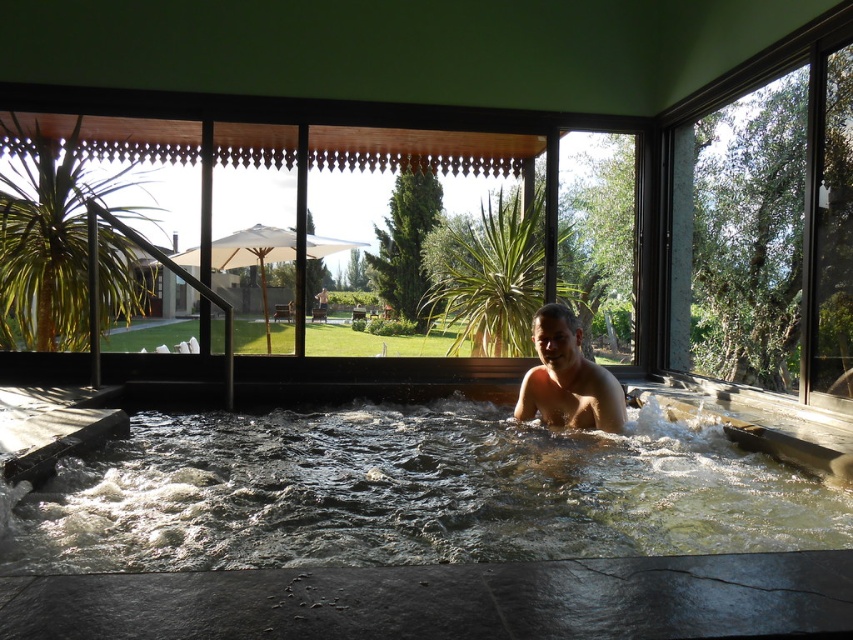
You are a photographer standing in the room and want to capture a shot of the clear water at center and the smooth tan skin at center. Which object is positioned closer to your camera lens?

The clear water at center is closer to the viewer than the smooth tan skin at center, so the clear water at center will appear closer to the camera lens.